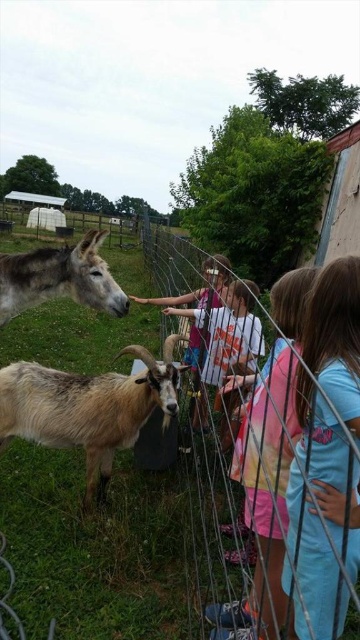
Does wire mesh fence at center appear on the left side of blue cotton shirt at right?

Correct, you'll find wire mesh fence at center to the left of blue cotton shirt at right.

Can you confirm if wire mesh fence at center is shorter than blue cotton shirt at right?

Incorrect, wire mesh fence at center's height does not fall short of blue cotton shirt at right's.

I want to click on wire mesh fence at center, so click(289, 484).

Does point (245, 488) lie in front of point (300, 324)?

No, (245, 488) is behind (300, 324).

Which is more to the right, wire mesh fence at center or light blue cotton shirt at center?

From the viewer's perspective, light blue cotton shirt at center appears more on the right side.

Between point (312, 429) and point (246, 477), which one is positioned in front?

Point (312, 429) is more forward.

At what (x,y) coordinates should I click in order to perform the action: click on wire mesh fence at center. Please return your answer as a coordinate pair (x, y). This screenshot has height=640, width=360. Looking at the image, I should click on (289, 484).

Is light blue cotton shirt at center closer to camera compared to gray matte donkey at left?

Yes, it is in front of gray matte donkey at left.

Can you confirm if light blue cotton shirt at center is bigger than gray matte donkey at left?

Yes, light blue cotton shirt at center is bigger than gray matte donkey at left.

Does point (288, 435) lie behind point (78, 262)?

No.

The width and height of the screenshot is (360, 640). Find the location of `light blue cotton shirt at center`. light blue cotton shirt at center is located at coordinates (268, 467).